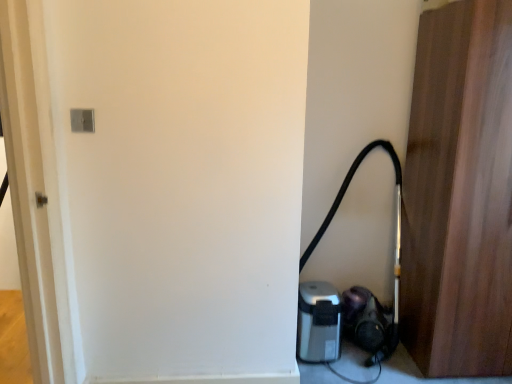
Question: Is black rubber garden hose at lower right far from silver metallic coffee maker at lower right?

Choices:
 (A) yes
 (B) no

Answer: (B)

Question: Is black rubber garden hose at lower right oriented towards silver metallic coffee maker at lower right?

Choices:
 (A) yes
 (B) no

Answer: (A)

Question: From the image's perspective, does black rubber garden hose at lower right appear lower than silver metallic coffee maker at lower right?

Choices:
 (A) no
 (B) yes

Answer: (A)

Question: From a real-world perspective, is black rubber garden hose at lower right located beneath silver metallic coffee maker at lower right?

Choices:
 (A) yes
 (B) no

Answer: (B)

Question: Is black rubber garden hose at lower right shorter than silver metallic coffee maker at lower right?

Choices:
 (A) yes
 (B) no

Answer: (B)

Question: Is the position of black rubber garden hose at lower right more distant than that of silver metallic coffee maker at lower right?

Choices:
 (A) yes
 (B) no

Answer: (B)

Question: Is silver metallic coffee maker at lower right bigger than black rubber garden hose at lower right?

Choices:
 (A) no
 (B) yes

Answer: (A)

Question: Does silver metallic coffee maker at lower right turn towards black rubber garden hose at lower right?

Choices:
 (A) yes
 (B) no

Answer: (A)

Question: From a real-world perspective, is silver metallic coffee maker at lower right over black rubber garden hose at lower right?

Choices:
 (A) yes
 (B) no

Answer: (B)

Question: Does silver metallic coffee maker at lower right have a greater width compared to black rubber garden hose at lower right?

Choices:
 (A) yes
 (B) no

Answer: (B)

Question: Can you confirm if silver metallic coffee maker at lower right is positioned to the right of black rubber garden hose at lower right?

Choices:
 (A) yes
 (B) no

Answer: (B)

Question: Is silver metallic coffee maker at lower right closer to the viewer compared to black rubber garden hose at lower right?

Choices:
 (A) yes
 (B) no

Answer: (B)

Question: Is wooden door at right to the left of silver metallic coffee maker at lower right from the viewer's perspective?

Choices:
 (A) no
 (B) yes

Answer: (A)